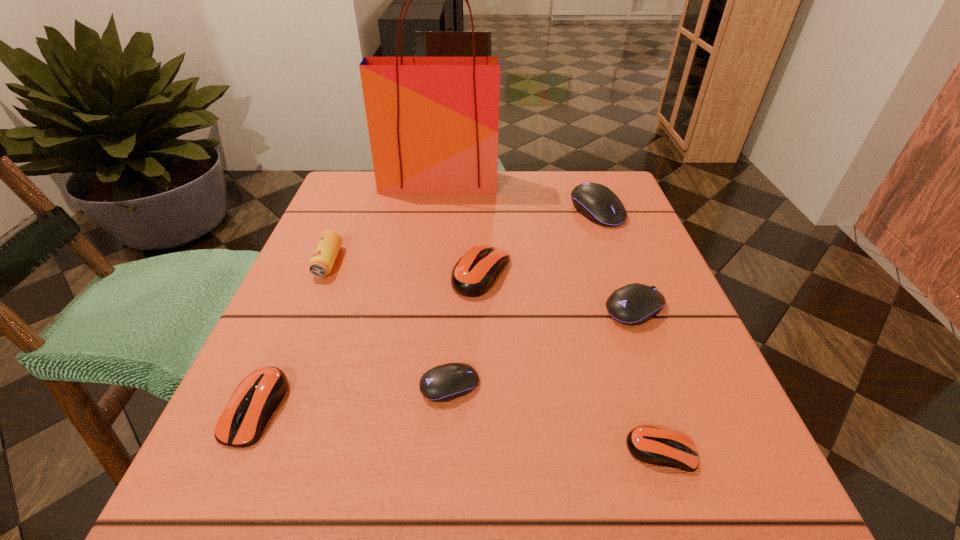
Where is `the nearest black computer mouse`? the nearest black computer mouse is located at coordinates (446, 382).

Locate an element on the screen. The image size is (960, 540). the smallest black computer mouse is located at coordinates (446, 382).

Where is `the smallest orange computer mouse`? The width and height of the screenshot is (960, 540). the smallest orange computer mouse is located at coordinates (652, 445).

This screenshot has height=540, width=960. Identify the location of the rightmost orange computer mouse. (652, 445).

The image size is (960, 540). What are the coordinates of `vacant space located on the handle side of the tallest object` in the screenshot? It's located at (433, 226).

In order to click on vacant space positioned 0.320m on the left of the farthest computer mouse in this screenshot , I will do `click(432, 211)`.

The width and height of the screenshot is (960, 540). I want to click on vacant region located on the front of the beer can, so click(x=237, y=482).

This screenshot has width=960, height=540. In order to click on free spot located 0.110m on the front of the biggest orange computer mouse in this screenshot , I will do `click(482, 346)`.

Locate an element on the screen. This screenshot has height=540, width=960. free space located on the back of the second nearest black computer mouse is located at coordinates pyautogui.click(x=588, y=182).

Identify the location of free space located on the right of the leftmost orange computer mouse. The image size is (960, 540). (401, 408).